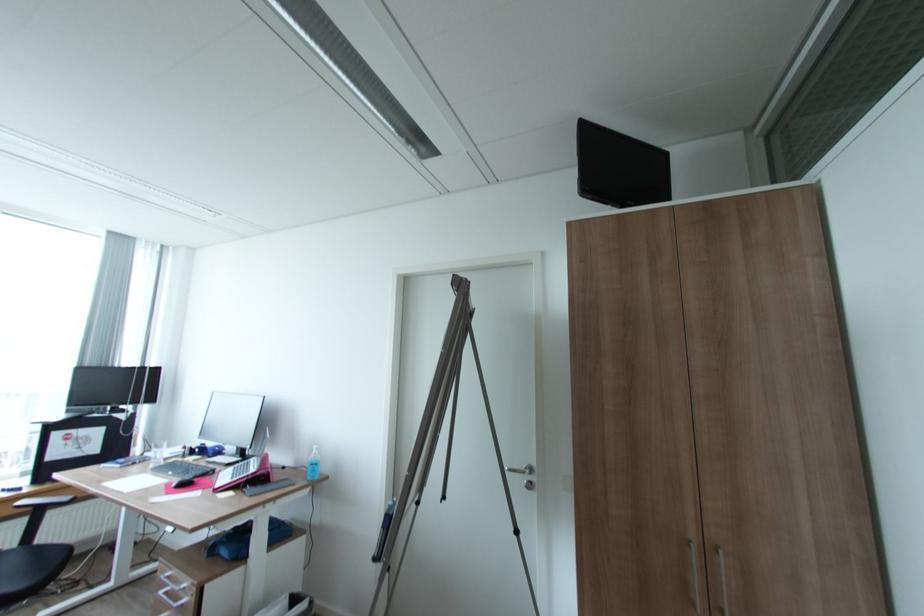
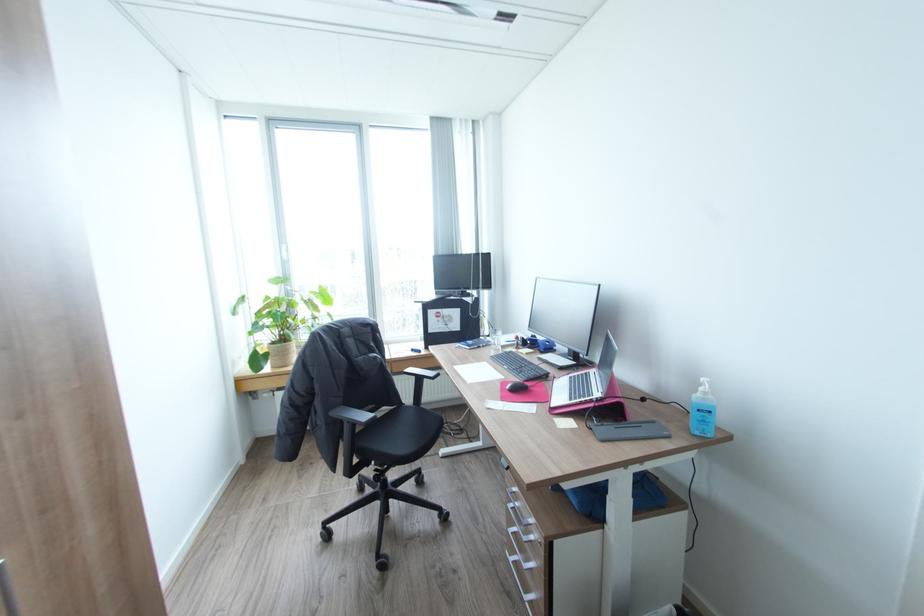
Locate, in the second image, the point that corresponds to point (257, 496) in the first image.

(608, 440)